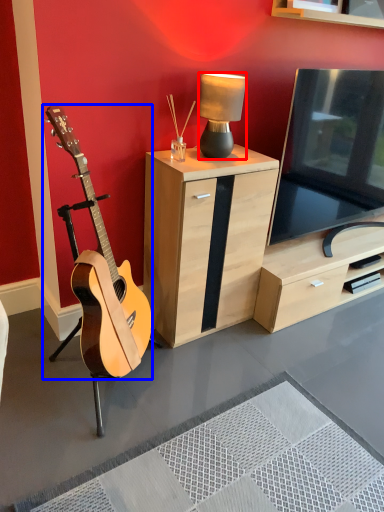
Question: Among these objects, which one is nearest to the camera, lamp (highlighted by a red box) or guitar (highlighted by a blue box)?

Choices:
 (A) lamp
 (B) guitar

Answer: (B)